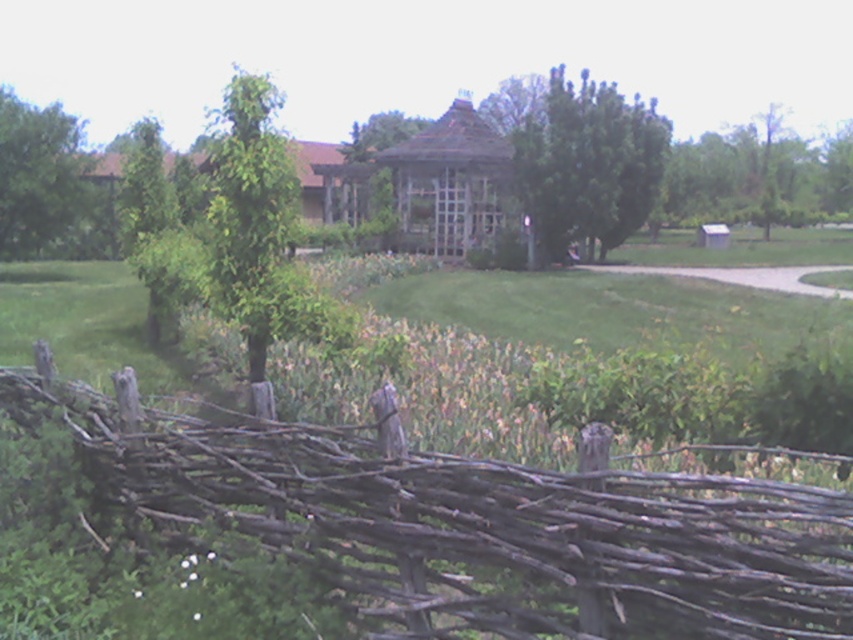
Question: Which point is closer to the camera taking this photo?

Choices:
 (A) (585, 205)
 (B) (21, 257)

Answer: (A)

Question: Which object is the farthest from the green leafy tree at upper right?

Choices:
 (A) green leafy tree at upper left
 (B) green leafy tree at center
 (C) brown rustic fence at lower left

Answer: (C)

Question: Which object appears farthest from the camera in this image?

Choices:
 (A) brown rustic fence at lower left
 (B) green leafy tree at upper right
 (C) green leafy tree at upper left
 (D) green leafy tree at center

Answer: (B)

Question: Can you confirm if green leafy tree at center is bigger than green leafy tree at upper right?

Choices:
 (A) no
 (B) yes

Answer: (A)

Question: Is green leafy tree at center positioned at the back of green leafy tree at upper right?

Choices:
 (A) yes
 (B) no

Answer: (B)

Question: Is green leafy tree at center closer to camera compared to green leafy tree at upper left?

Choices:
 (A) no
 (B) yes

Answer: (A)